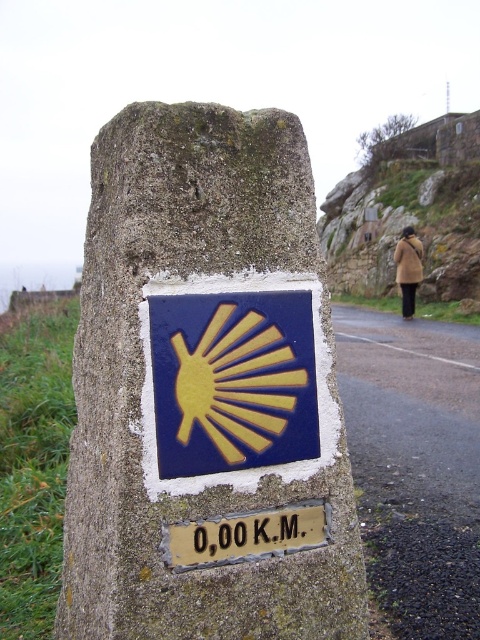
Consider the image. Does stone at center have a greater height compared to black plastic sign at center?

Indeed, stone at center has a greater height compared to black plastic sign at center.

How much distance is there between stone at center and black plastic sign at center?

12.95 inches

Is point (249, 483) in front of point (276, 518)?

Yes.

Identify the location of stone at center. (204, 387).

Is goldmaterial/textureplaque at lower center positioned at the back of black plastic sign at center?

No.

Between point (275, 516) and point (266, 522), which one is positioned behind?

Point (275, 516)

Locate an element on the screen. goldmaterial/textureplaque at lower center is located at coordinates (245, 536).

Which is more to the left, goldmaterial/textureplaque at lower center or brown woolen coat at center-right?

From the viewer's perspective, goldmaterial/textureplaque at lower center appears more on the left side.

Between goldmaterial/textureplaque at lower center and brown woolen coat at center-right, which one has less height?

goldmaterial/textureplaque at lower center

Who is more forward, (165,532) or (407,228)?

Point (165,532) is in front.

In order to click on goldmaterial/textureplaque at lower center in this screenshot , I will do `click(245, 536)`.